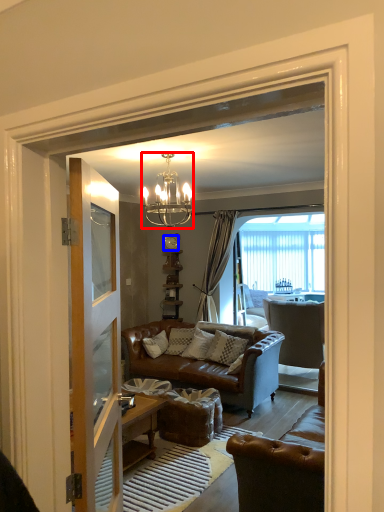
Question: Which point is further to the camera, lamp (highlighted by a red box) or clock (highlighted by a blue box)?

Choices:
 (A) lamp
 (B) clock

Answer: (B)